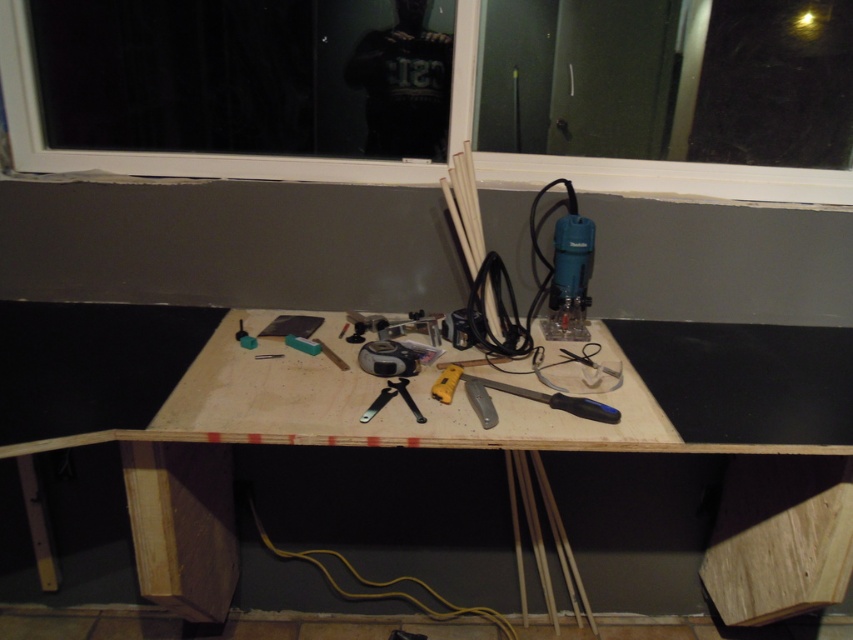
Which of these two, plywood table at center or blue plastic saw at center, stands taller?

Standing taller between the two is plywood table at center.

Identify the location of plywood table at center. (376, 522).

The width and height of the screenshot is (853, 640). Describe the element at coordinates (376, 522) in the screenshot. I see `plywood table at center` at that location.

At what (x,y) coordinates should I click in order to perform the action: click on plywood table at center. Please return your answer as a coordinate pair (x, y). The height and width of the screenshot is (640, 853). Looking at the image, I should click on [376, 522].

Does plywood table at center appear on the right side of transparent glass window at upper center?

Yes, plywood table at center is to the right of transparent glass window at upper center.

Locate an element on the screen. This screenshot has height=640, width=853. plywood table at center is located at coordinates (376, 522).

Who is more distant from viewer, (x=408, y=472) or (x=25, y=76)?

The point (x=408, y=472) is behind.

This screenshot has height=640, width=853. Identify the location of plywood table at center. (376, 522).

Consider the image. Does transparent glass window at upper center appear under blue plastic saw at center?

Actually, transparent glass window at upper center is above blue plastic saw at center.

Between transparent glass window at upper center and blue plastic saw at center, which one has more height?

Standing taller between the two is transparent glass window at upper center.

The width and height of the screenshot is (853, 640). Identify the location of transparent glass window at upper center. (161, 152).

Find the location of a particular element. transparent glass window at upper center is located at coordinates (161, 152).